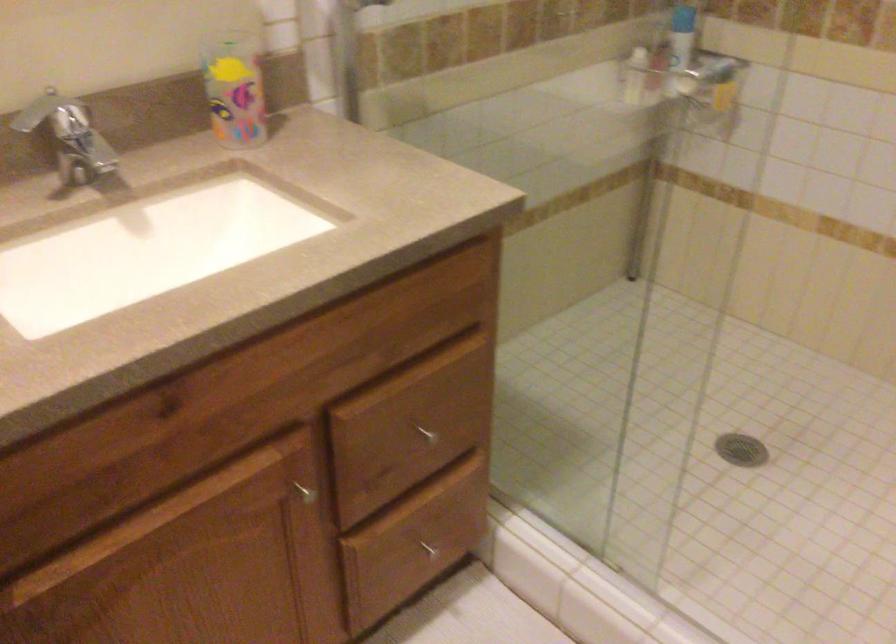
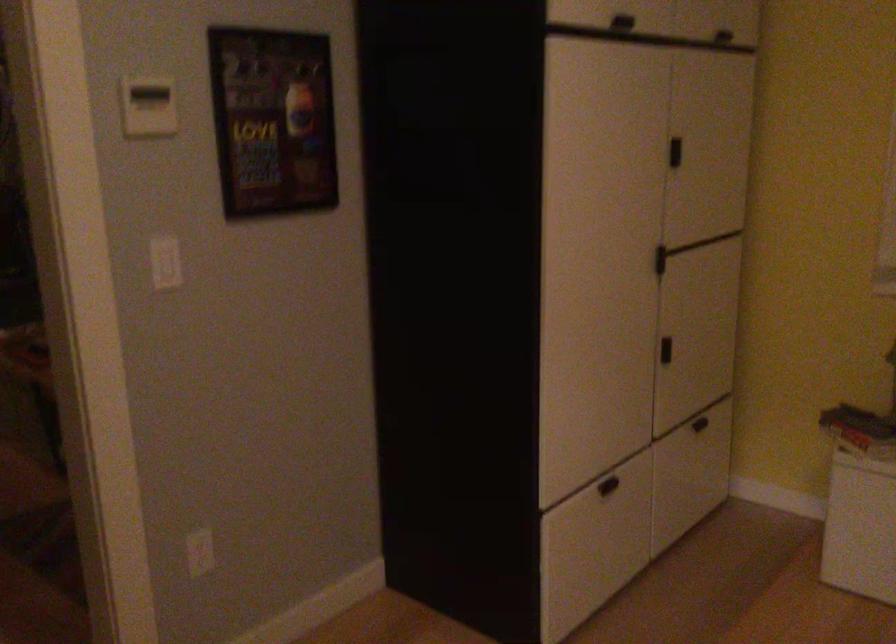
Question: The camera is either moving clockwise (left) or counter-clockwise (right) around the object. The first image is from the beginning of the video and the second image is from the end. Is the camera moving left or right when shooting the video?

Choices:
 (A) Left
 (B) Right

Answer: (A)